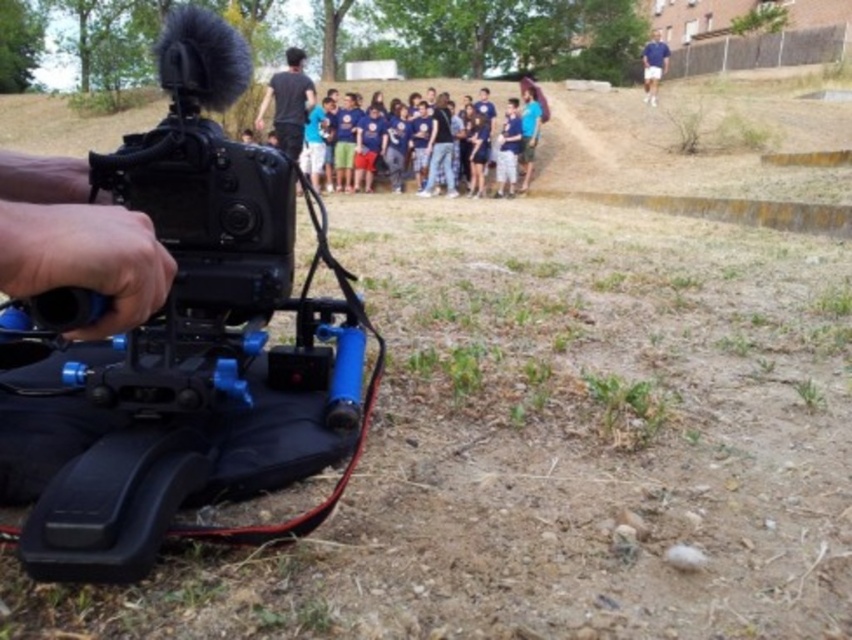
You are a photographer trying to capture a group photo of the blue cotton shirt at center and the black plastic video camera at left. Based on their positions, which one should you focus on first to ensure both are in frame?

The black plastic video camera at left is below the blue cotton shirt at center, so you should focus on the blue cotton shirt at center first to ensure both are in frame.

What are the coordinates of the black plastic video camera at left in the image?

The black plastic video camera at left is located at coordinates (183, 346).

You are a photographer trying to capture a shot of the blue cotton shirt at upper right without the black plastic video camera at left blocking the view. Is the camera currently blocking the shirt?

The black plastic video camera at left is positioned under the blue cotton shirt at upper right, so it is not blocking the view of the shirt. The shirt is above the camera in this arrangement.